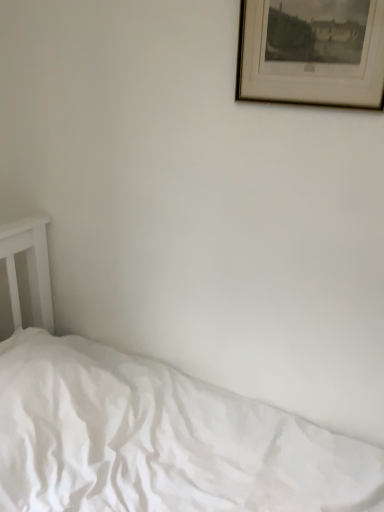
Question: Is white cotton bed at lower left positioned far away from wooden picture frame at upper right?

Choices:
 (A) yes
 (B) no

Answer: (A)

Question: Is white cotton bed at lower left smaller than wooden picture frame at upper right?

Choices:
 (A) no
 (B) yes

Answer: (A)

Question: From a real-world perspective, does white cotton bed at lower left sit lower than wooden picture frame at upper right?

Choices:
 (A) no
 (B) yes

Answer: (B)

Question: Considering the relative sizes of white cotton bed at lower left and wooden picture frame at upper right in the image provided, is white cotton bed at lower left bigger than wooden picture frame at upper right?

Choices:
 (A) yes
 (B) no

Answer: (A)

Question: From the image's perspective, does white cotton bed at lower left appear lower than wooden picture frame at upper right?

Choices:
 (A) yes
 (B) no

Answer: (A)

Question: Is white cotton bed at lower left to the right of wooden picture frame at upper right from the viewer's perspective?

Choices:
 (A) no
 (B) yes

Answer: (A)

Question: Does wooden picture frame at upper right appear on the right side of white cotton bed at lower left?

Choices:
 (A) yes
 (B) no

Answer: (A)

Question: Is wooden picture frame at upper right not near white cotton bed at lower left?

Choices:
 (A) yes
 (B) no

Answer: (A)

Question: Does wooden picture frame at upper right have a greater height compared to white cotton bed at lower left?

Choices:
 (A) yes
 (B) no

Answer: (B)

Question: Could you tell me if wooden picture frame at upper right is facing white cotton bed at lower left?

Choices:
 (A) yes
 (B) no

Answer: (B)

Question: Considering the relative sizes of wooden picture frame at upper right and white cotton bed at lower left in the image provided, is wooden picture frame at upper right wider than white cotton bed at lower left?

Choices:
 (A) yes
 (B) no

Answer: (B)

Question: From a real-world perspective, is wooden picture frame at upper right physically above white cotton bed at lower left?

Choices:
 (A) no
 (B) yes

Answer: (B)

Question: Is wooden picture frame at upper right bigger or smaller than white cotton bed at lower left?

Choices:
 (A) small
 (B) big

Answer: (A)